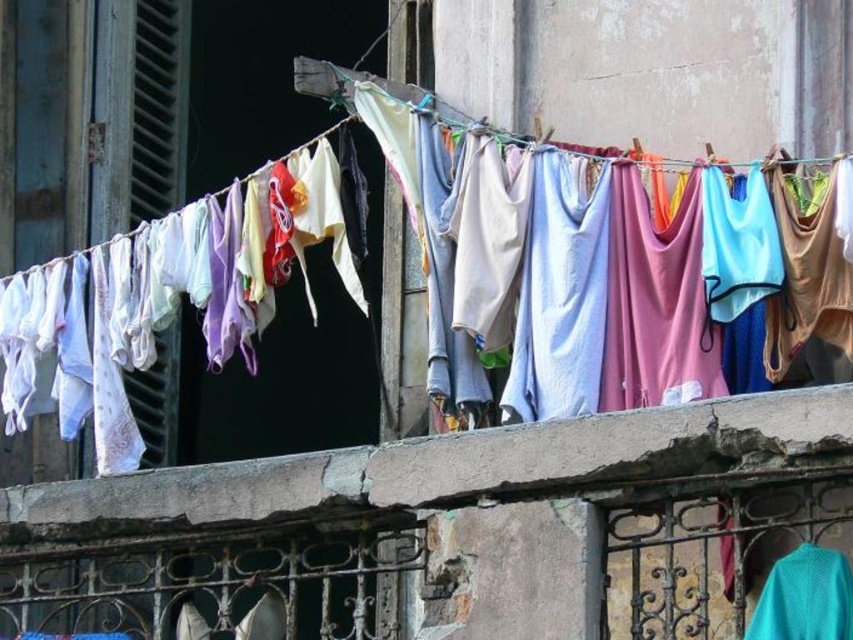
Between concrete at center and white cotton towel at center, which one is positioned lower?

concrete at center is lower down.

Which is in front, point (434, 547) or point (16, 385)?

Point (434, 547) is more forward.

What are the coordinates of `concrete at center` in the screenshot? It's located at (450, 529).